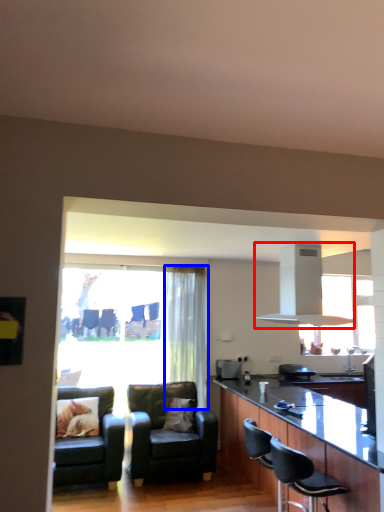
Question: Which of the following is the farthest to the observer, exhaust hood (highlighted by a red box) or curtain (highlighted by a blue box)?

Choices:
 (A) exhaust hood
 (B) curtain

Answer: (B)